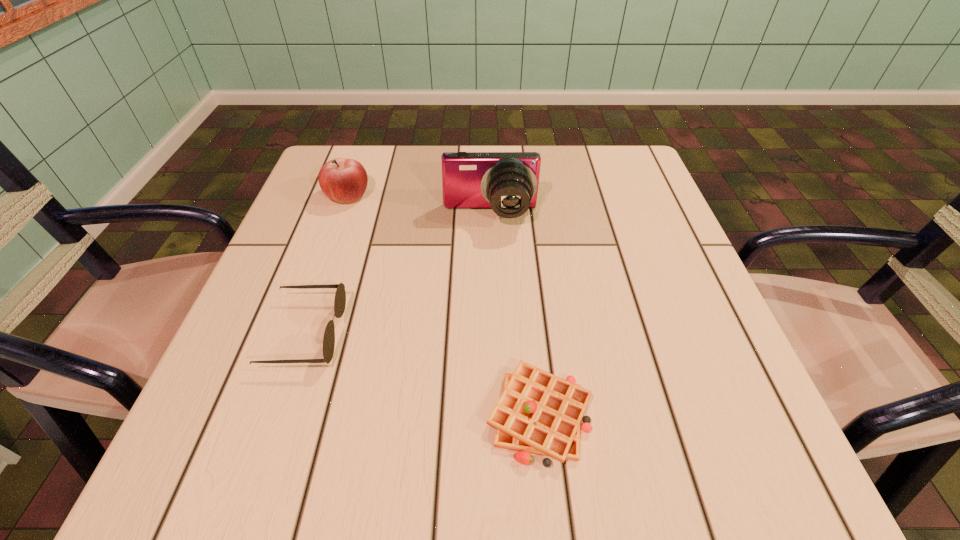
The image size is (960, 540). I want to click on free spot that satisfies the following two spatial constraints: 1. on the front-facing side of the tallest object; 2. on the front-facing side of the third tallest object, so click(x=493, y=333).

Find the location of a particular element. The width and height of the screenshot is (960, 540). vacant area that satisfies the following two spatial constraints: 1. on the front-facing side of the tallest object; 2. on the left side of the shortest object is located at coordinates (495, 415).

You are a GUI agent. You are given a task and a screenshot of the screen. Output one action in this format:
    pyautogui.click(x=<x>, y=<y>)
    Task: Click on the blank area in the image that satisfies the following two spatial constraints: 1. on the front side of the third shortest object; 2. on the right side of the waffle
    This screenshot has height=540, width=960.
    Given the screenshot: What is the action you would take?
    pyautogui.click(x=270, y=415)

Where is `free location that satisfies the following two spatial constraints: 1. on the front-facing side of the waffle; 2. on the right side of the camera`? Image resolution: width=960 pixels, height=540 pixels. free location that satisfies the following two spatial constraints: 1. on the front-facing side of the waffle; 2. on the right side of the camera is located at coordinates (495, 415).

Where is `vacant space that satisfies the following two spatial constraints: 1. on the front-facing side of the tallest object; 2. on the right side of the waffle`? The height and width of the screenshot is (540, 960). vacant space that satisfies the following two spatial constraints: 1. on the front-facing side of the tallest object; 2. on the right side of the waffle is located at coordinates (495, 415).

I want to click on free space in the image that satisfies the following two spatial constraints: 1. on the front-facing side of the camera; 2. on the front-facing side of the third tallest object, so click(493, 333).